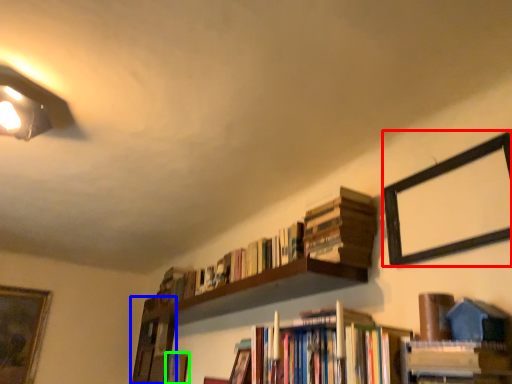
Question: Which object is positioned farthest from picture frame (highlighted by a red box)? Select from shelf (highlighted by a blue box) and book (highlighted by a green box).

Choices:
 (A) shelf
 (B) book

Answer: (A)